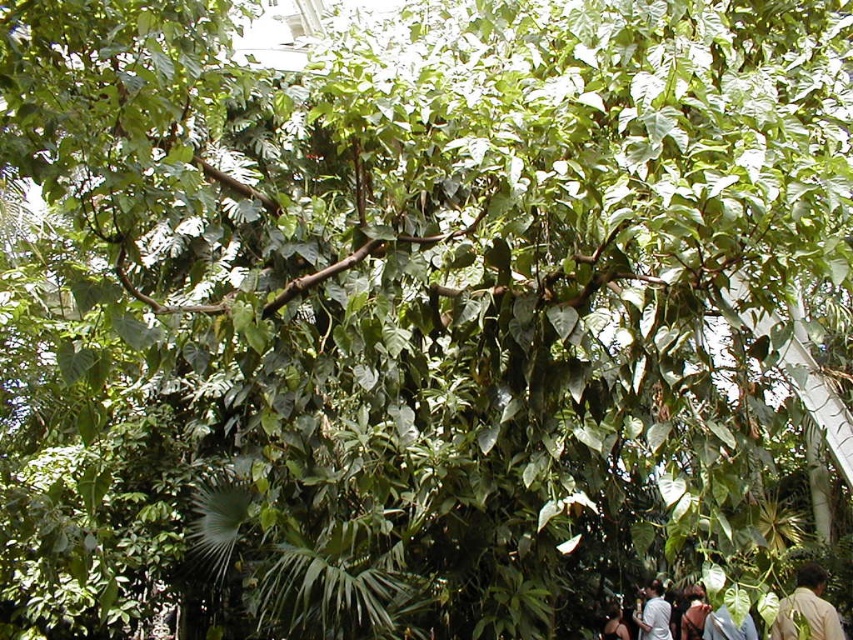
You are a photographer in the tropical environment. You see a light brown skin at lower right and a white shirt at lower right. Which one is closer to the ground?

The light brown skin at lower right is closer to the ground since it has a lesser height compared to the white shirt at lower right.

You are a photographer positioned at the front of the scene. You want to take a clear photo of the light brown leather jacket at lower center without the white shirt at lower right blocking it. What should you do?

The light brown leather jacket at lower center is behind the white shirt at lower right, so to take a clear photo of the light brown leather jacket at lower center without obstruction, you should move the white shirt at lower right out of the way or adjust your angle to avoid it.

You are an observer standing in the tropical environment and notice two items at the lower right corner of the scene. Which one is wider between the light brown skin at lower right and the light brown leather jacket at lower right?

The light brown skin at lower right is wider than the light brown leather jacket at lower right according to the description.